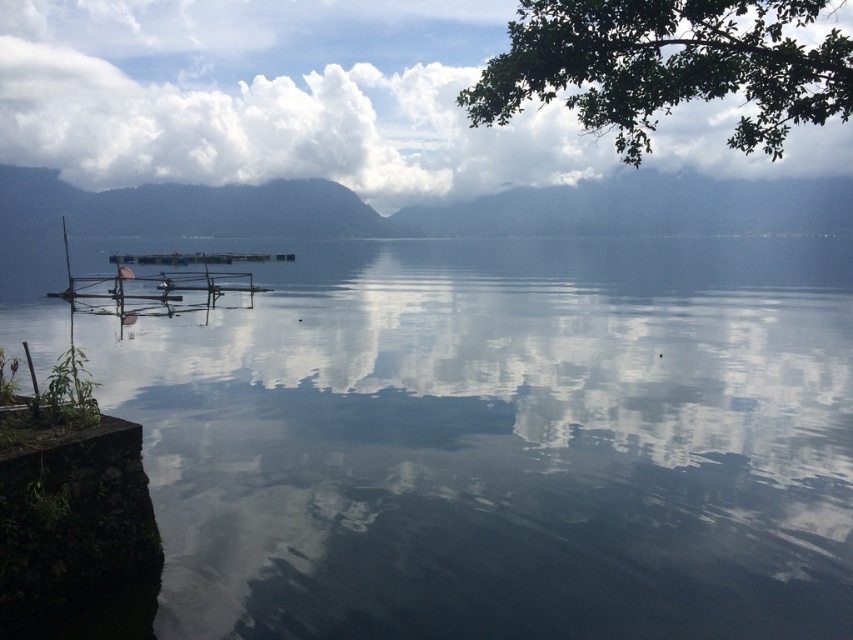
You are a photographer planning to take a picture of the wooden dock at center. If you want to position the dock exactly at the center of your camera frame, which is at point coordinates of 0.5, 0.5, should you move your camera slightly to the left or right?

The wooden dock at center is located at coordinates (x=160, y=280). To center it at (x=426, y=320), you should move the camera slightly to the right and upwards since the dock is to the left and below the desired center point.

You are an artist planning to paint the lakeside scene. You want to ensure the green leafy branch at upper right and the wooden dock at center are proportionally accurate. Which object should you draw larger in your painting?

The green leafy branch at upper right should be drawn larger since it is much taller than the wooden dock at center.